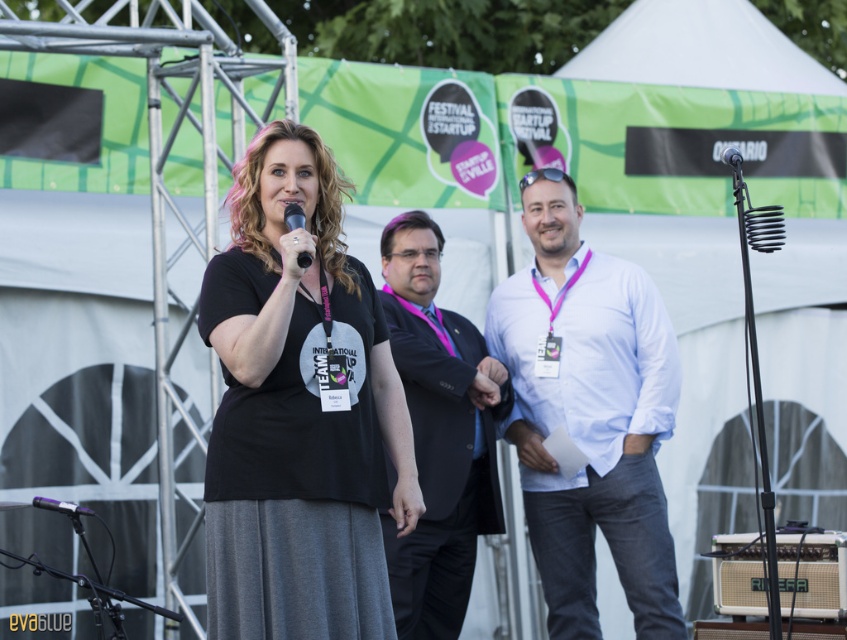
Does white cotton shirt at center have a larger size compared to metallic purple microphone at lower left?

Indeed, white cotton shirt at center has a larger size compared to metallic purple microphone at lower left.

Is point (529, 470) in front of point (72, 513)?

No.

Which is in front, point (567, 349) or point (70, 509)?

Point (70, 509)

The image size is (847, 640). Identify the location of white cotton shirt at center. (590, 413).

How far apart are black matte t-shirt at center and metallic purple microphone at lower left?

black matte t-shirt at center and metallic purple microphone at lower left are 1.10 meters apart.

Which is below, black matte t-shirt at center or metallic purple microphone at lower left?

metallic purple microphone at lower left

Find the location of a particular element. This screenshot has height=640, width=847. black matte t-shirt at center is located at coordinates (297, 412).

Who is more forward, (322, 481) or (292, 204)?

Point (322, 481)

Which of these two, black matte t-shirt at center or matte black microphone at center, stands shorter?

With less height is matte black microphone at center.

Between point (357, 492) and point (283, 211), which one is positioned behind?

Positioned behind is point (283, 211).

Locate an element on the screen. black matte t-shirt at center is located at coordinates (297, 412).